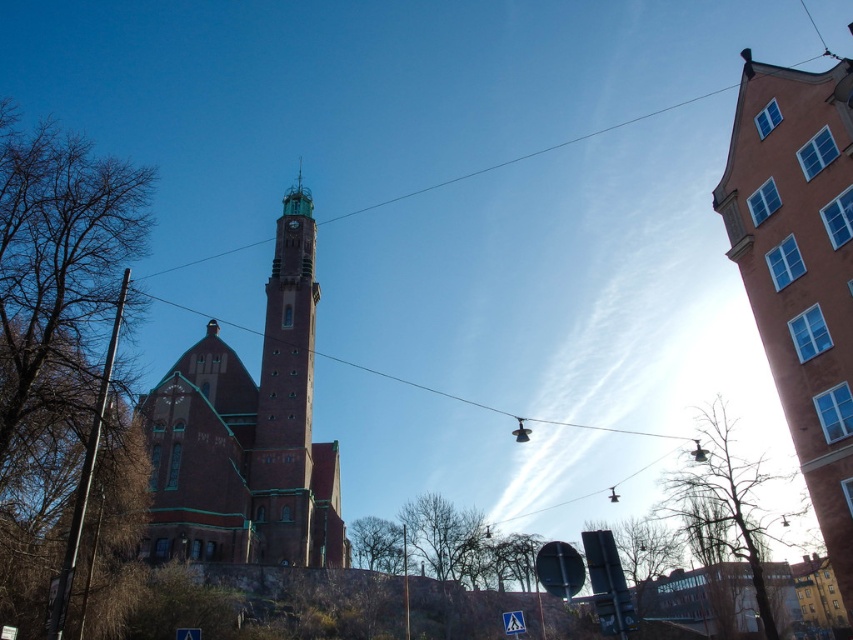
Question: Does brick church at center have a smaller size compared to greenish-brown stone clock tower at center-left?

Choices:
 (A) yes
 (B) no

Answer: (B)

Question: Which point is farther from the camera taking this photo?

Choices:
 (A) (289, 224)
 (B) (247, 560)
 (C) (796, 371)

Answer: (A)

Question: Is the position of brick church at center less distant than that of greenish-brown stone clock tower at center-left?

Choices:
 (A) yes
 (B) no

Answer: (A)

Question: Which is farther from the greenish-brown stone clock tower at center-left?

Choices:
 (A) brick church at center
 (B) terracotta brick church at upper right

Answer: (B)

Question: Considering the relative positions of terracotta brick church at upper right and brick church at center in the image provided, where is terracotta brick church at upper right located with respect to brick church at center?

Choices:
 (A) right
 (B) left

Answer: (A)

Question: Among these objects, which one is farthest from the camera?

Choices:
 (A) greenish-brown stone clock tower at center-left
 (B) terracotta brick church at upper right
 (C) brick church at center

Answer: (A)